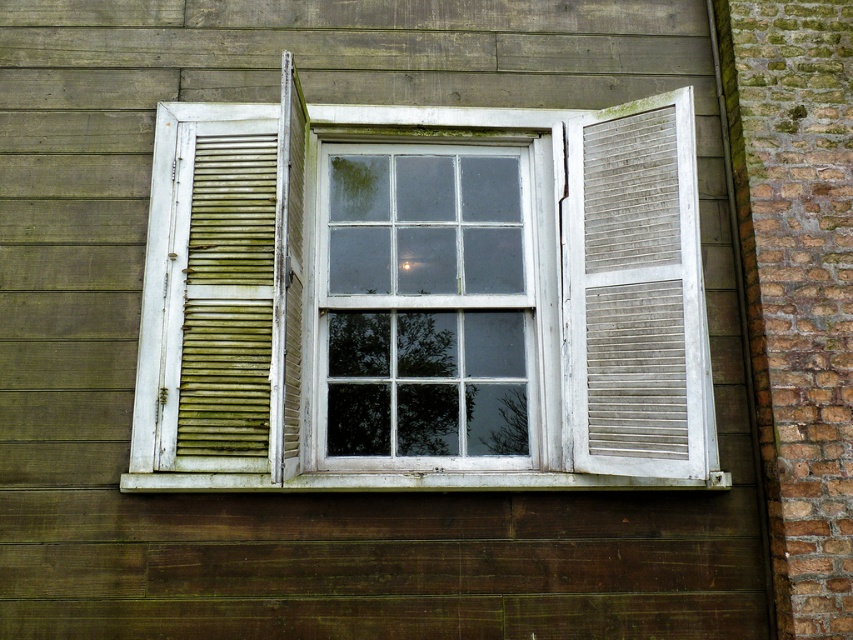
Question: Based on their relative distances, which object is farther from the white wood at center?

Choices:
 (A) white wood window at center
 (B) white wood slats at right
 (C) green weathered wood at left

Answer: (B)

Question: In this image, where is white wood window at center located relative to white wooden window at center?

Choices:
 (A) right
 (B) left

Answer: (A)

Question: Which object appears closest to the camera in this image?

Choices:
 (A) white wood window at center
 (B) white wood slats at right
 (C) white wooden window at center

Answer: (A)

Question: Can you confirm if white wood window at center is smaller than green weathered wood at left?

Choices:
 (A) yes
 (B) no

Answer: (B)

Question: Does white wood window at center have a smaller size compared to green weathered wood at left?

Choices:
 (A) yes
 (B) no

Answer: (B)

Question: Which point is closer to the camera taking this photo?

Choices:
 (A) (248, 275)
 (B) (662, 228)
 (C) (387, 189)
 (D) (143, 291)

Answer: (B)